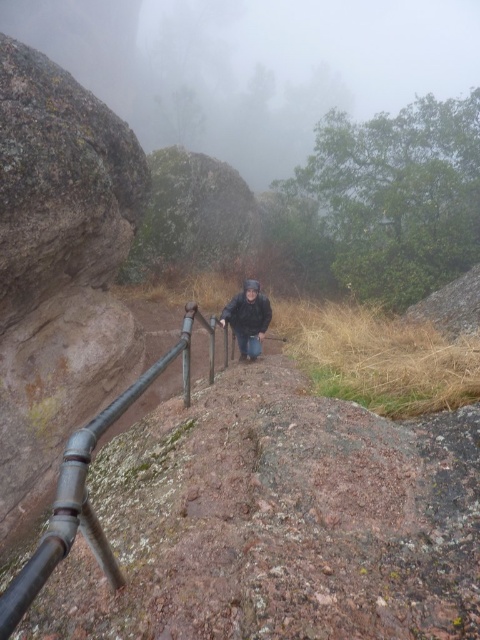
You are a hiker trying to navigate the steep trail. You see the metallic pipe at center and the dark gray jacket at center. Which object is closer to the left side of the trail?

The metallic pipe at center is positioned on the left side of dark gray jacket at center, so the metallic pipe at center is closer to the left side of the trail.

Consider the image. You are a hiker on a misty trail. You notice a metallic pipe at center and a dark gray jacket at center. Which object is closer to you as you look forward?

The metallic pipe at center is closer to you because it is in front of the dark gray jacket at center.

In the scene shown: You are a hiker planning to climb the steep trail shown in the image. You notice a metallic pipe at center and a dark gray jacket at center. Which object is shorter in height?

The metallic pipe at center has a lesser height compared to dark gray jacket at center, so the metallic pipe at center is shorter in height.